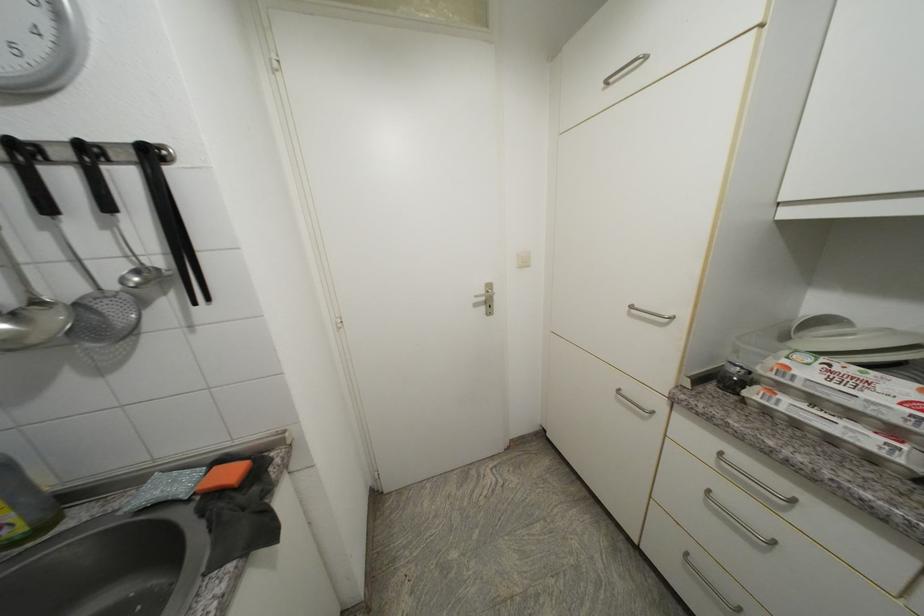
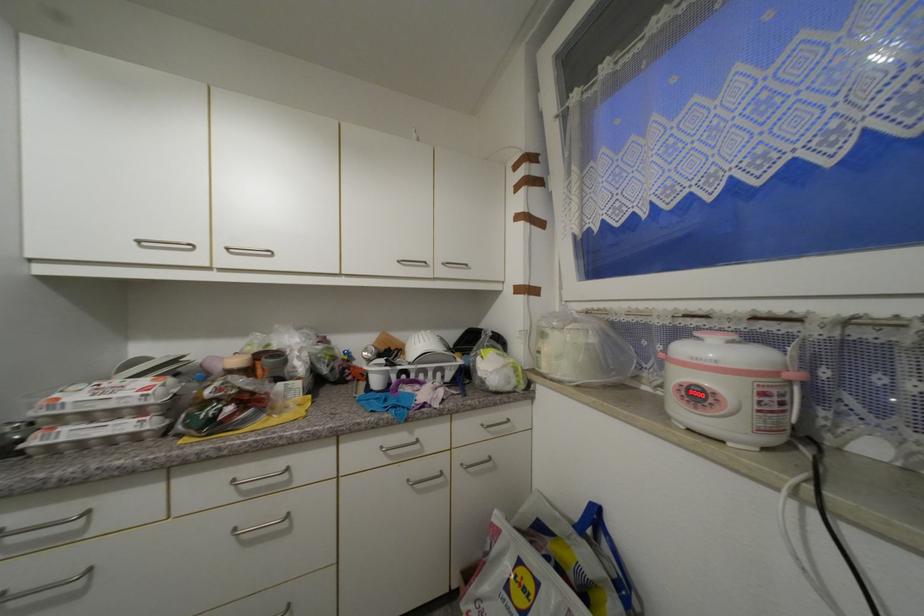
Question: How did the camera likely rotate?

Choices:
 (A) Left
 (B) Right
 (C) Up
 (D) Down

Answer: (B)